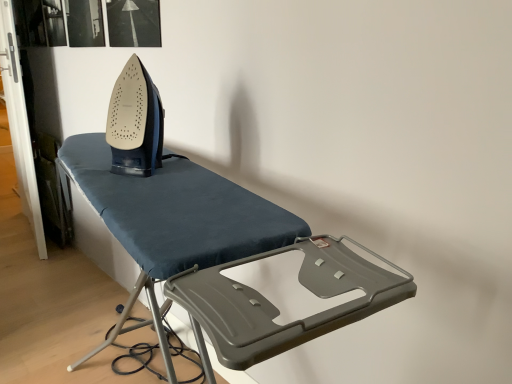
Question: From a real-world perspective, is matte black iron at center below dark blue fabric ironing board at center?

Choices:
 (A) no
 (B) yes

Answer: (A)

Question: Is matte black iron at center positioned behind dark blue fabric ironing board at center?

Choices:
 (A) no
 (B) yes

Answer: (B)

Question: Would you say matte black iron at center is a long distance from dark blue fabric ironing board at center?

Choices:
 (A) no
 (B) yes

Answer: (A)

Question: Does matte black iron at center appear on the right side of dark blue fabric ironing board at center?

Choices:
 (A) no
 (B) yes

Answer: (A)

Question: Does matte black iron at center come in front of dark blue fabric ironing board at center?

Choices:
 (A) yes
 (B) no

Answer: (B)

Question: From a real-world perspective, is matte black iron at center physically above dark blue fabric ironing board at center?

Choices:
 (A) yes
 (B) no

Answer: (A)

Question: From a real-world perspective, is dark blue fabric ironing board at center located beneath matte black iron at center?

Choices:
 (A) yes
 (B) no

Answer: (A)

Question: Is dark blue fabric ironing board at center in contact with matte black iron at center?

Choices:
 (A) yes
 (B) no

Answer: (B)

Question: From a real-world perspective, does dark blue fabric ironing board at center stand above matte black iron at center?

Choices:
 (A) no
 (B) yes

Answer: (A)

Question: Does dark blue fabric ironing board at center lie behind matte black iron at center?

Choices:
 (A) yes
 (B) no

Answer: (B)

Question: Is dark blue fabric ironing board at center outside of matte black iron at center?

Choices:
 (A) no
 (B) yes

Answer: (B)

Question: Is dark blue fabric ironing board at center positioned before matte black iron at center?

Choices:
 (A) yes
 (B) no

Answer: (A)

Question: In terms of size, does dark blue fabric ironing board at center appear bigger or smaller than matte black iron at center?

Choices:
 (A) big
 (B) small

Answer: (A)